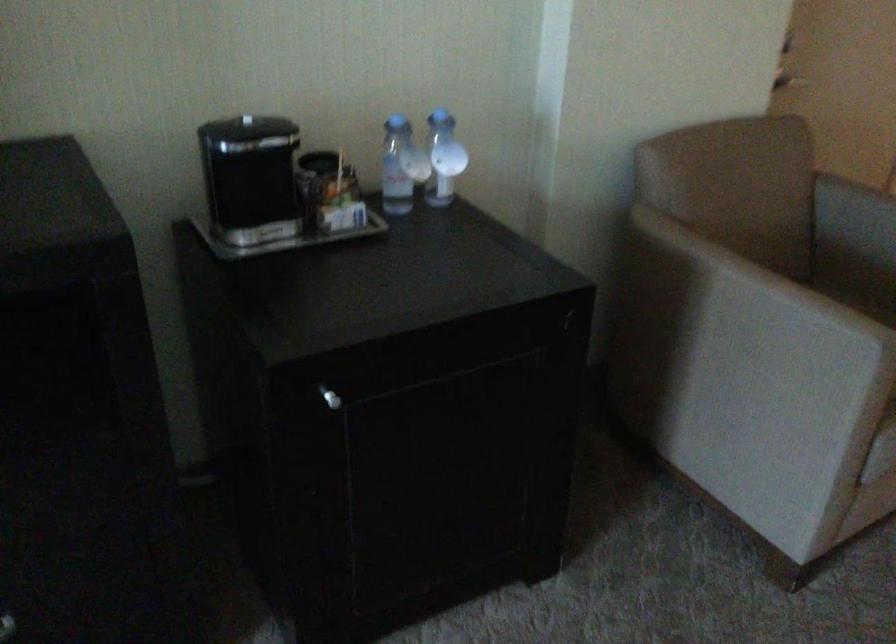
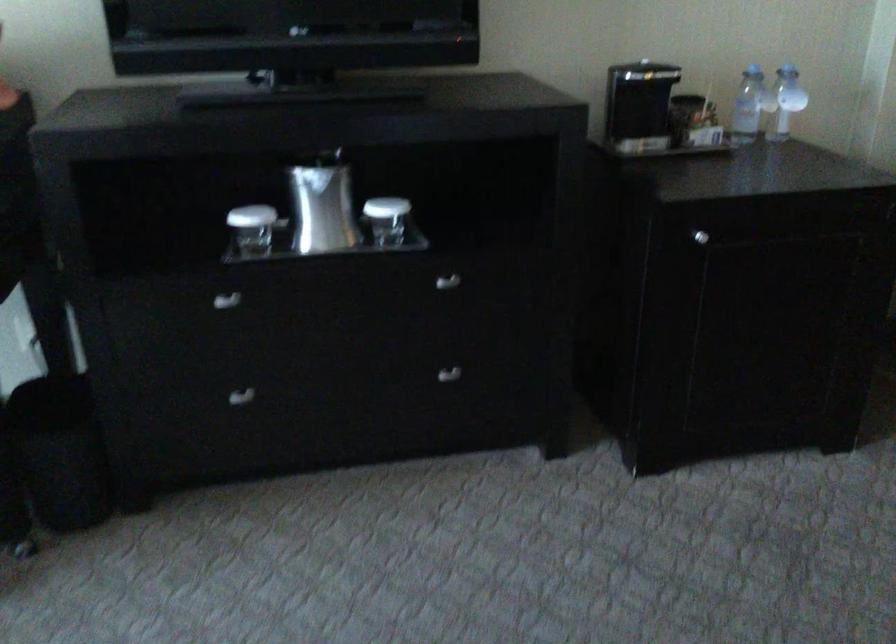
Question: How did the camera likely rotate?

Choices:
 (A) Left
 (B) Right
 (C) Up
 (D) Down

Answer: (A)